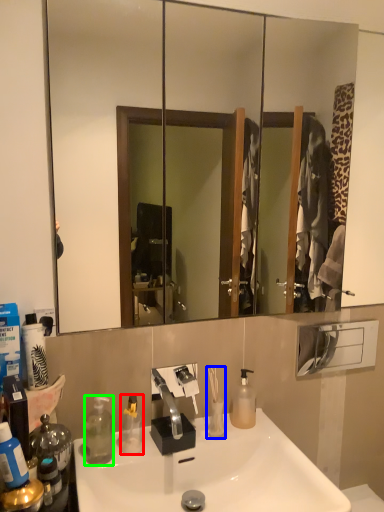
Question: Based on their relative distances, which object is farther from bottle (highlighted by a red box)? Choose from toiletry (highlighted by a blue box) and bottle (highlighted by a green box).

Choices:
 (A) toiletry
 (B) bottle

Answer: (A)